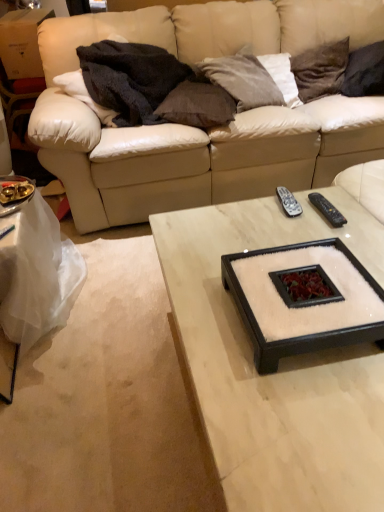
You are a GUI agent. You are given a task and a screenshot of the screen. Output one action in this format:
    pyautogui.click(x=<x>, y=<y>)
    Task: Click on the spots to the right of black plastic remote control at right, marked as the first remote control in a right-to-left arrangement
    
    Given the screenshot: What is the action you would take?
    pyautogui.click(x=352, y=214)